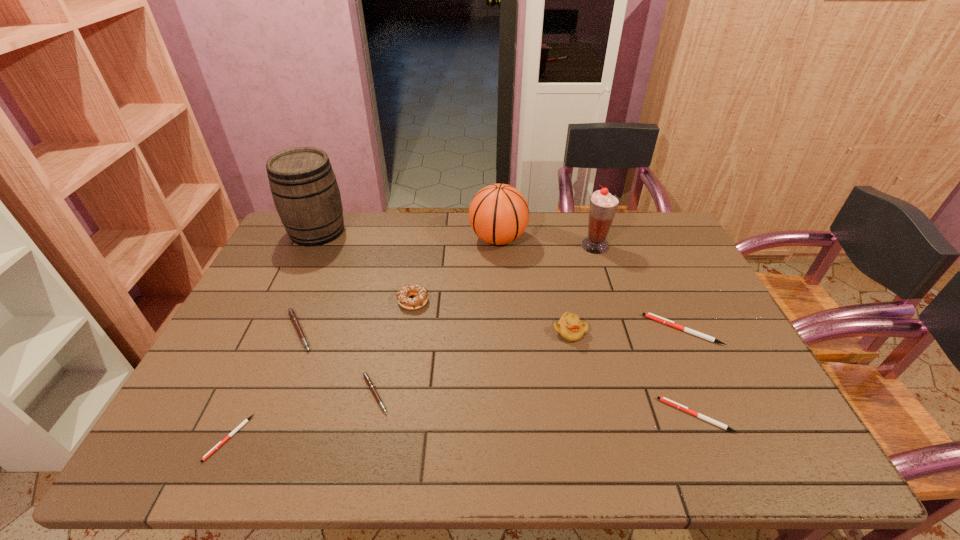
The height and width of the screenshot is (540, 960). I want to click on smoothie that is positioned at the far edge, so click(603, 205).

You are a GUI agent. You are given a task and a screenshot of the screen. Output one action in this format:
    pyautogui.click(x=<x>, y=<y>)
    Task: Click on the basketball that is positioned at the far edge
    This screenshot has width=960, height=540.
    Given the screenshot: What is the action you would take?
    pyautogui.click(x=498, y=214)

Where is `wine bucket that is at the left edge`? wine bucket that is at the left edge is located at coordinates (304, 188).

Where is `object that is at the far left corner`? Image resolution: width=960 pixels, height=540 pixels. object that is at the far left corner is located at coordinates (304, 188).

This screenshot has height=540, width=960. Identify the location of object present at the near left corner. (245, 421).

At what (x,y) coordinates should I click in order to perform the action: click on object that is at the near right corner. Please return your answer as a coordinate pair (x, y). The height and width of the screenshot is (540, 960). Looking at the image, I should click on (663, 399).

Where is `free region at the far edge`? The height and width of the screenshot is (540, 960). free region at the far edge is located at coordinates (578, 230).

Find the location of a particular element. The image size is (960, 540). vacant space at the near edge of the desktop is located at coordinates (332, 450).

Find the location of `free region at the left edge of the desktop`. free region at the left edge of the desktop is located at coordinates (226, 409).

Find the location of a particular element. This screenshot has width=960, height=540. vacant region at the right edge is located at coordinates (718, 393).